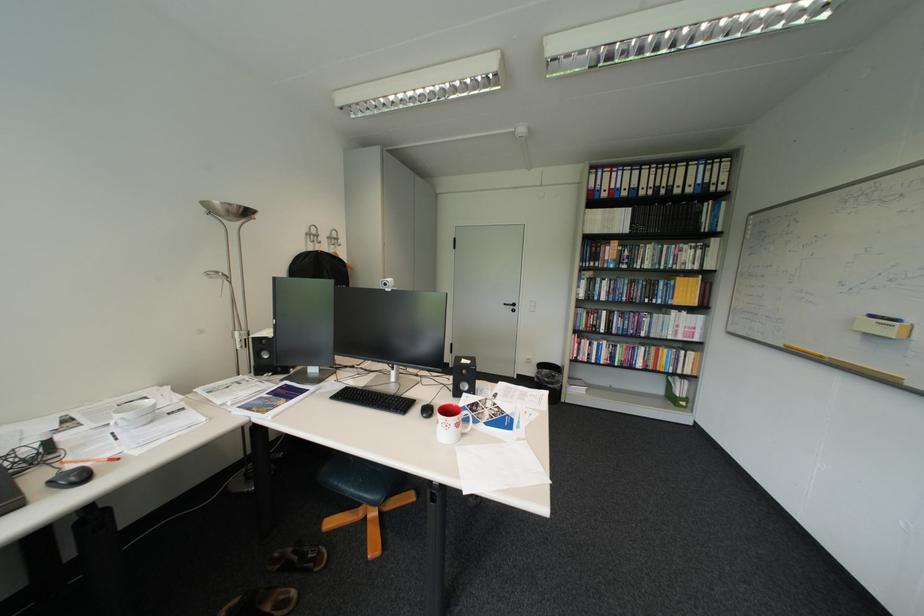
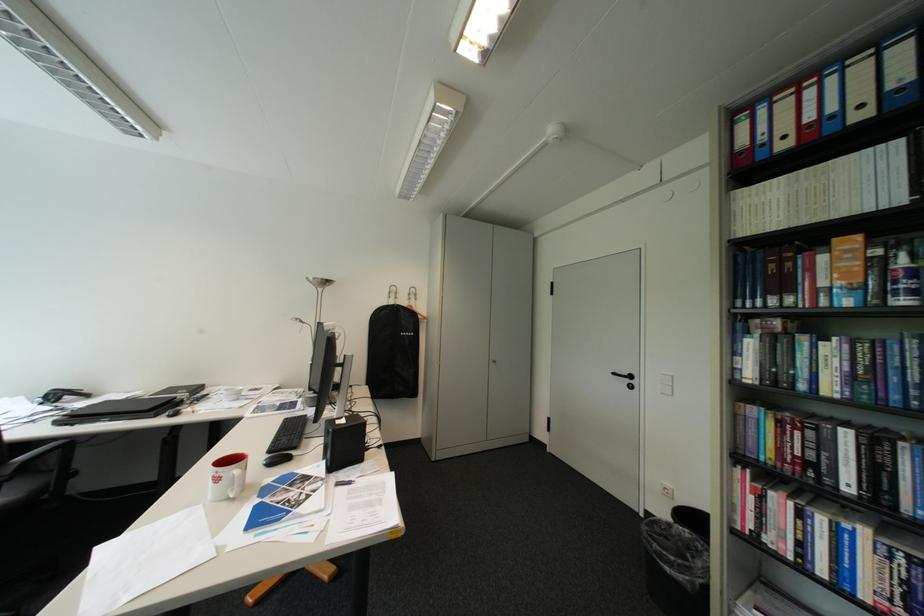
The point at [605,188] is marked in the first image. Where is the corresponding point in the second image?

(760, 145)